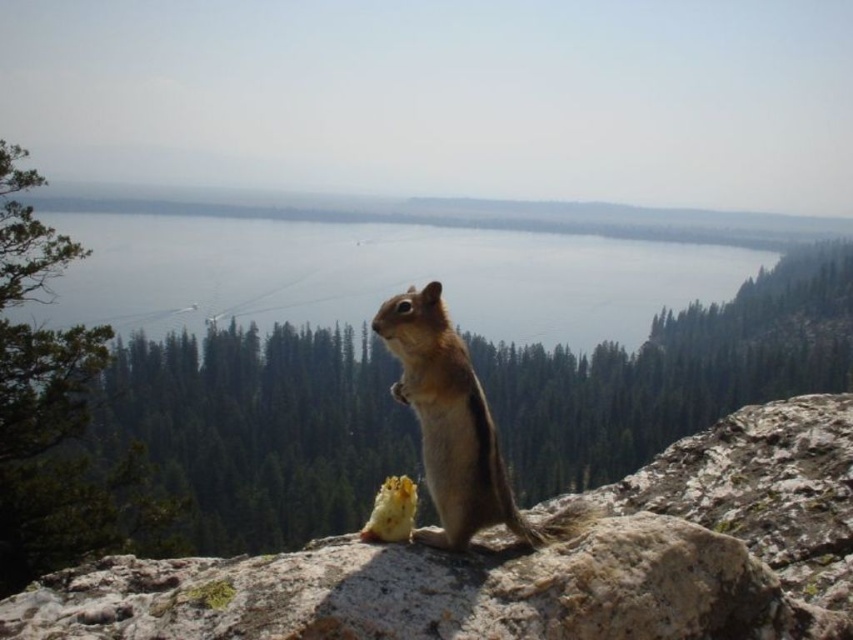
Who is higher up, gray rock at center or brown furry squirrel at center?

brown furry squirrel at center

Who is shorter, gray rock at center or brown furry squirrel at center?

Standing shorter between the two is gray rock at center.

Between point (711, 481) and point (410, 374), which one is positioned behind?

Point (711, 481)

I want to click on gray rock at center, so click(x=532, y=561).